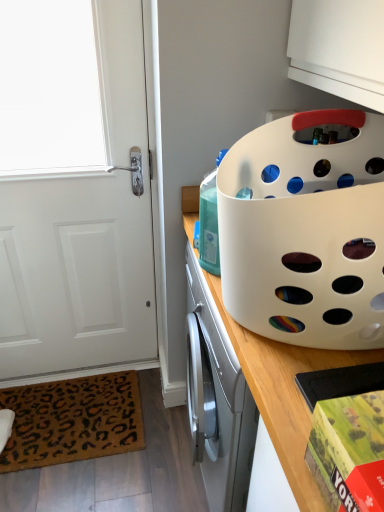
Question: From the image's perspective, is translucent plastic bottle at center positioned above or below white matte door at left?

Choices:
 (A) above
 (B) below

Answer: (A)

Question: Considering the positions of translucent plastic bottle at center and white matte door at left in the image, is translucent plastic bottle at center taller or shorter than white matte door at left?

Choices:
 (A) tall
 (B) short

Answer: (B)

Question: Considering the real-world distances, which object is closest to the translucent plastic bottle at center?

Choices:
 (A) red matte board game box at lower right
 (B) white plastic basket at upper right
 (C) brown leopard print mat at lower left
 (D) white plastic basket at upper right
 (E) white matte door at left

Answer: (D)

Question: Which of these objects is positioned farthest from the white plastic basket at upper right?

Choices:
 (A) brown leopard print mat at lower left
 (B) white plastic basket at upper right
 (C) red matte board game box at lower right
 (D) white matte door at left
 (E) translucent plastic bottle at center

Answer: (A)